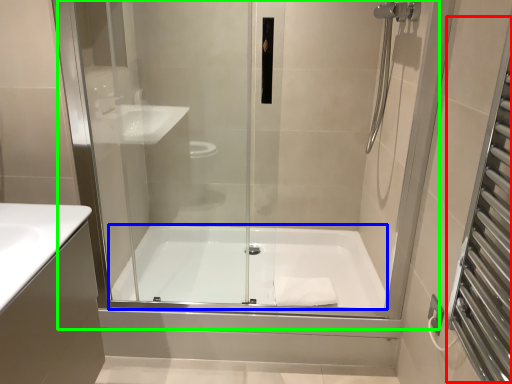
Question: Which is farther away from screen door (highlighted by a red box)? bathtub (highlighted by a blue box) or shower door (highlighted by a green box)?

Choices:
 (A) bathtub
 (B) shower door

Answer: (A)